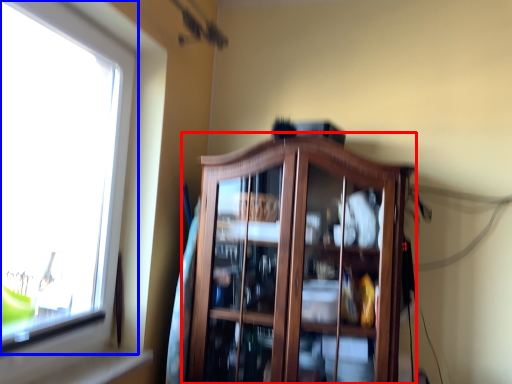
Question: Which point is closer to the camera, dresser (highlighted by a red box) or window (highlighted by a blue box)?

Choices:
 (A) dresser
 (B) window

Answer: (B)